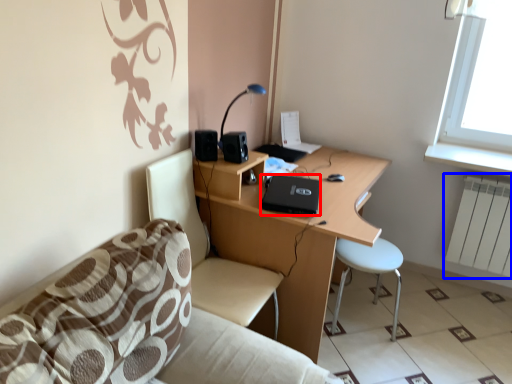
Question: Which object appears farthest to the camera in this image, laptop (highlighted by a red box) or radiator (highlighted by a blue box)?

Choices:
 (A) laptop
 (B) radiator

Answer: (B)